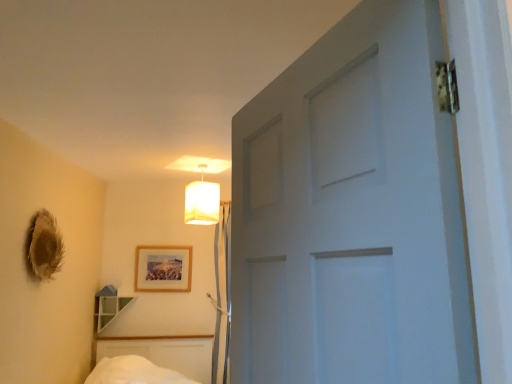
Question: From a real-world perspective, relative to wooden picture frame at center, is clear glass shelf at lower left vertically above or below?

Choices:
 (A) above
 (B) below

Answer: (B)

Question: Looking at the image, does clear glass shelf at lower left seem bigger or smaller compared to wooden picture frame at center?

Choices:
 (A) small
 (B) big

Answer: (B)

Question: Considering the real-world distances, which object is farthest from the wooden picture frame at center?

Choices:
 (A) clear glass shelf at lower left
 (B) matte white lampshade at upper center

Answer: (B)

Question: Which object is the closest to the matte white lampshade at upper center?

Choices:
 (A) clear glass shelf at lower left
 (B) wooden picture frame at center

Answer: (B)